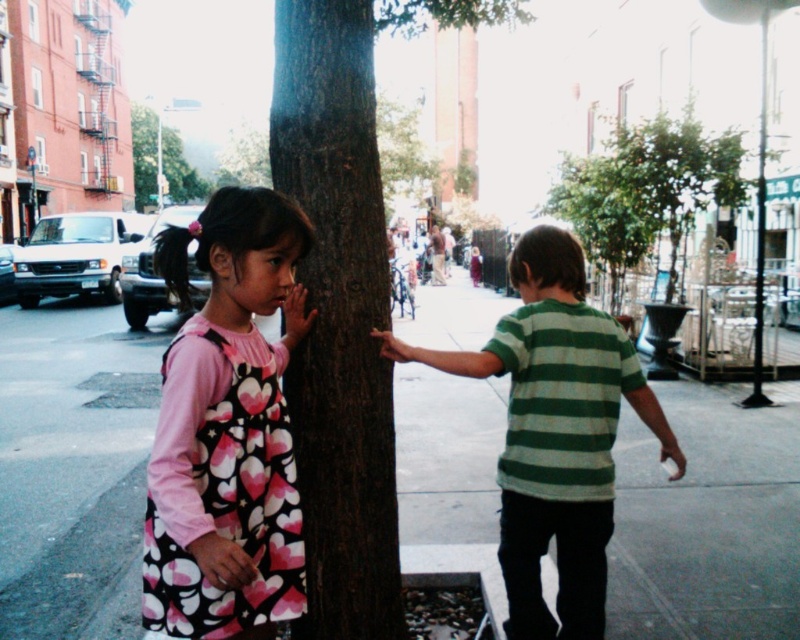
Who is higher up, pink heart-patterned dress at left or green textured tree at upper center?

green textured tree at upper center

Is point (226, 236) farther from viewer compared to point (176, 196)?

No, (226, 236) is in front of (176, 196).

This screenshot has width=800, height=640. In order to click on pink heart-patterned dress at left in this screenshot , I will do `click(226, 429)`.

Between gray concrete sidewalk at center and green striped shirt at center, which one appears on the left side from the viewer's perspective?

gray concrete sidewalk at center

Looking at this image, which is above, gray concrete sidewalk at center or green striped shirt at center?

green striped shirt at center is higher up.

What are the coordinates of `gray concrete sidewalk at center` in the screenshot? It's located at (73, 468).

Between gray concrete sidewalk at center and brown rough tree trunk at center, which one has less height?

gray concrete sidewalk at center

Locate an element on the screen. gray concrete sidewalk at center is located at coordinates (73, 468).